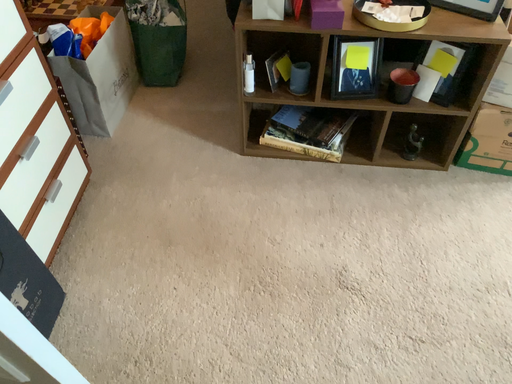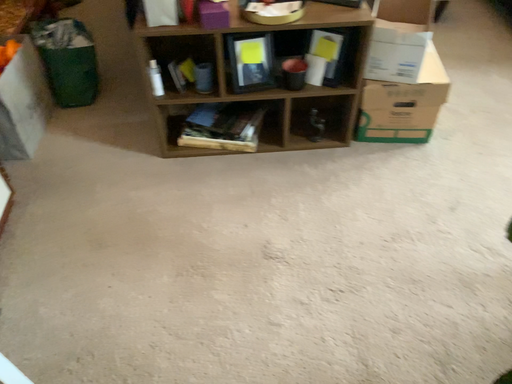
Question: Which way did the camera rotate in the video?

Choices:
 (A) rotated right
 (B) rotated left

Answer: (A)